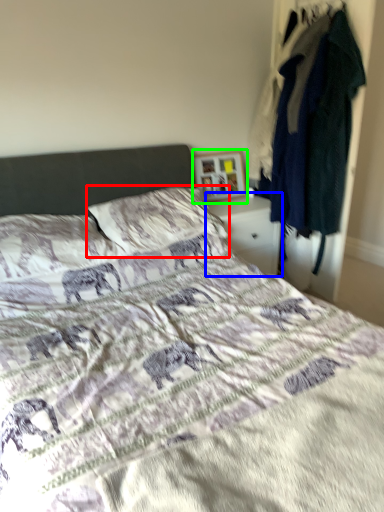
Question: Which object is the closest to the pillow (highlighted by a red box)? Choose among these: nightstand (highlighted by a blue box) or picture frame (highlighted by a green box).

Choices:
 (A) nightstand
 (B) picture frame

Answer: (A)